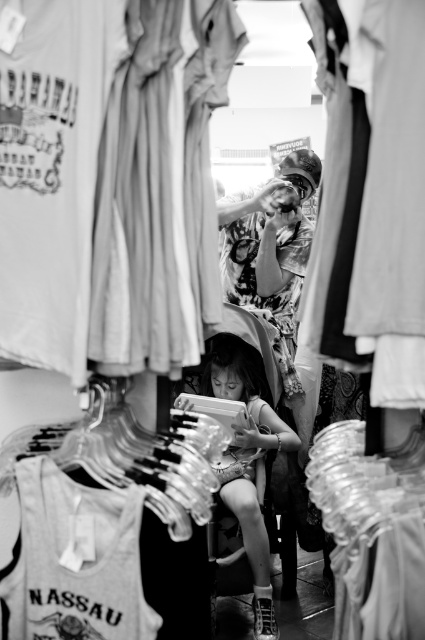
Which of these two, matte white blouse at center or smooth skin child at center, stands shorter?

matte white blouse at center

Who is more distant from viewer, (x=416, y=372) or (x=234, y=456)?

The point (x=234, y=456) is more distant.

Identify the location of matte white blouse at center. (374, 205).

Does white cotton tank top at lower left have a smaller size compared to smooth skin child at center?

Correct, white cotton tank top at lower left occupies less space than smooth skin child at center.

Find the location of a particular element. The height and width of the screenshot is (640, 425). white cotton tank top at lower left is located at coordinates (76, 561).

I want to click on white cotton tank top at lower left, so click(76, 561).

Between white cotton tank top at lower left and printed fabric shirt at center, which one has less height?

white cotton tank top at lower left

Between point (96, 525) and point (255, 204), which one is positioned behind?

Positioned behind is point (255, 204).

You are a GUI agent. You are given a task and a screenshot of the screen. Output one action in this format:
    pyautogui.click(x=<x>, y=<y>)
    Task: Click on the white cotton tank top at lower left
    The height and width of the screenshot is (640, 425).
    Given the screenshot: What is the action you would take?
    pyautogui.click(x=76, y=561)